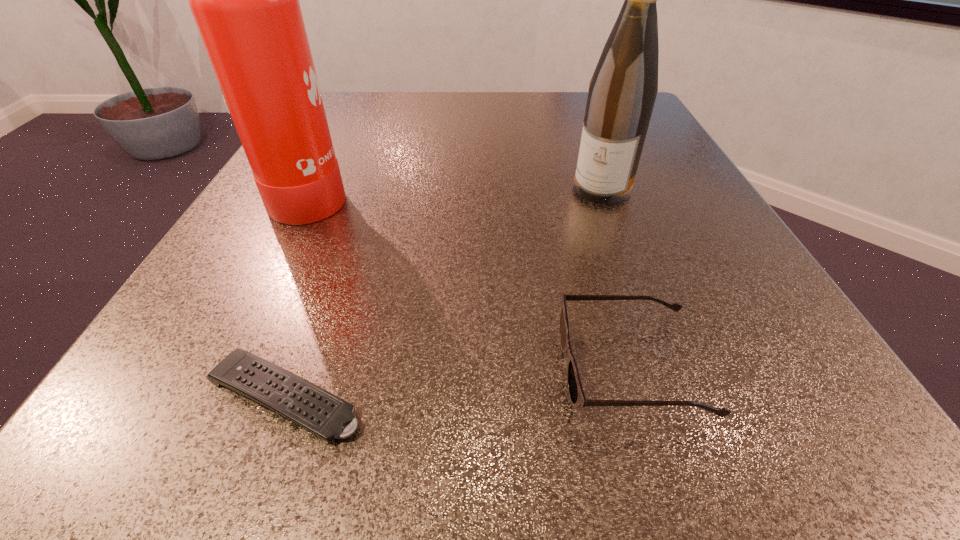
Locate an element on the screen. This screenshot has height=540, width=960. vacant region between the remote control and the second shortest object is located at coordinates (458, 382).

Identify the location of vacant point located between the wine bottle and the fire extinguisher. The height and width of the screenshot is (540, 960). (458, 190).

Identify the location of free area in between the shortest object and the wine bottle. (444, 292).

Where is `unoccupied position between the third tallest object and the fire extinguisher`? This screenshot has width=960, height=540. unoccupied position between the third tallest object and the fire extinguisher is located at coordinates pos(471,280).

This screenshot has width=960, height=540. I want to click on object that is the third closest one to the third tallest object, so click(x=245, y=0).

Identify the location of object that is the second closest to the wine bottle. The image size is (960, 540). (245, 0).

In order to click on blank space that satisfies the following two spatial constraints: 1. towards the nozzle of the fire extinguisher; 2. on the right side of the shortest object in this screenshot , I will do `click(208, 396)`.

You are a GUI agent. You are given a task and a screenshot of the screen. Output one action in this format:
    pyautogui.click(x=<x>, y=<y>)
    Task: Click on the free spot that satisfies the following two spatial constraints: 1. on the front lenses of the second shortest object; 2. on the front side of the remote control
    The height and width of the screenshot is (540, 960).
    Given the screenshot: What is the action you would take?
    pyautogui.click(x=638, y=396)

Identify the location of vacant space that satisfies the following two spatial constraints: 1. on the back side of the shortest object; 2. towards the nozzle of the fire extinguisher. (360, 192).

Identify the location of blank area in the image that satisfies the following two spatial constraints: 1. towards the nozzle of the shortest object; 2. on the right side of the fire extinguisher. (208, 396).